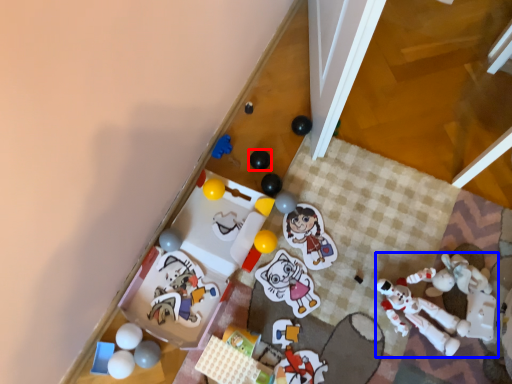
Question: Which object appears closest to the camera in this image, toy (highlighted by a red box) or toy (highlighted by a blue box)?

Choices:
 (A) toy
 (B) toy

Answer: (B)